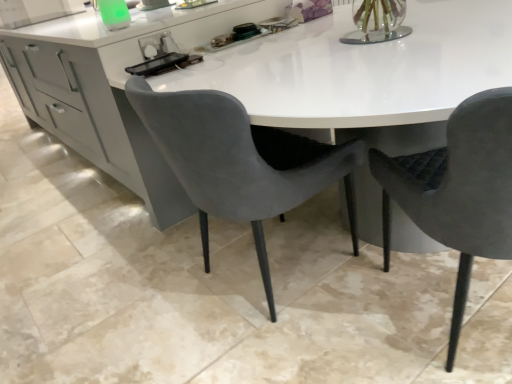
This screenshot has width=512, height=384. What are the coordinates of `vacant area that lies in front of velvet grey chair at center, arranged as the 2th chair when viewed from the right` in the screenshot? It's located at (304, 350).